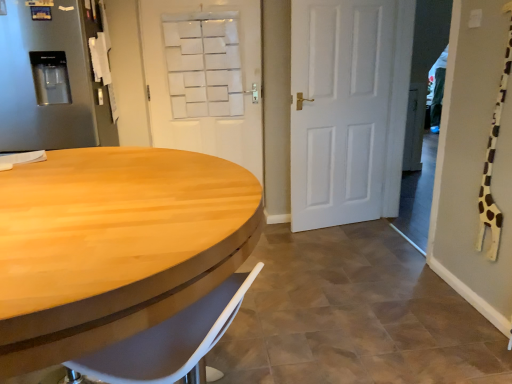
Question: From a real-world perspective, is white matte door at center, placed as the second door when sorted from left to right, physically above satin silver refrigerator at left?

Choices:
 (A) yes
 (B) no

Answer: (B)

Question: Is satin silver refrigerator at left inside white matte door at center, placed as the second door when sorted from left to right?

Choices:
 (A) yes
 (B) no

Answer: (B)

Question: Does white matte door at center, which is the first door in right-to-left order, come behind satin silver refrigerator at left?

Choices:
 (A) no
 (B) yes

Answer: (B)

Question: Is white matte door at center, placed as the second door when sorted from left to right, thinner than satin silver refrigerator at left?

Choices:
 (A) yes
 (B) no

Answer: (A)

Question: Is white matte door at center, placed as the second door when sorted from left to right, oriented towards satin silver refrigerator at left?

Choices:
 (A) yes
 (B) no

Answer: (B)

Question: Does white matte door at center, placed as the second door when sorted from left to right, have a smaller size compared to satin silver refrigerator at left?

Choices:
 (A) yes
 (B) no

Answer: (A)

Question: Is satin silver refrigerator at left further to the viewer compared to white matte door at center, which is the first door in right-to-left order?

Choices:
 (A) no
 (B) yes

Answer: (A)

Question: From the image's perspective, would you say satin silver refrigerator at left is shown under white matte door at center, placed as the second door when sorted from left to right?

Choices:
 (A) no
 (B) yes

Answer: (A)

Question: Is satin silver refrigerator at left at the left side of white matte door at center, placed as the second door when sorted from left to right?

Choices:
 (A) no
 (B) yes

Answer: (B)

Question: Is satin silver refrigerator at left far from white matte door at center, which is the first door in right-to-left order?

Choices:
 (A) no
 (B) yes

Answer: (B)

Question: Does satin silver refrigerator at left appear on the right side of white matte door at center, placed as the second door when sorted from left to right?

Choices:
 (A) yes
 (B) no

Answer: (B)

Question: From a real-world perspective, is satin silver refrigerator at left physically above white matte door at center, which is the first door in right-to-left order?

Choices:
 (A) yes
 (B) no

Answer: (A)

Question: Does light wood/wooden table at left have a greater width compared to white matte door at upper center, which is counted as the second door, starting from the right?

Choices:
 (A) yes
 (B) no

Answer: (A)